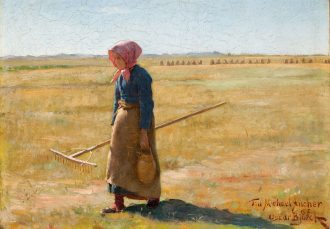
Where is `handle`? handle is located at coordinates (193, 111).